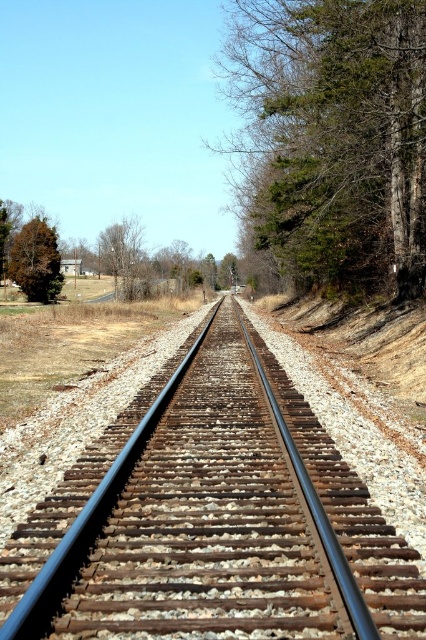
Question: Does rusty metal train track at center have a lesser width compared to green leafy tree at right?

Choices:
 (A) no
 (B) yes

Answer: (B)

Question: Which point is closer to the camera?

Choices:
 (A) green matte tree at left
 (B) green leafy tree at right
 (C) rusty metal train track at center

Answer: (C)

Question: Can you confirm if rusty metal train track at center is wider than green leafy tree at right?

Choices:
 (A) yes
 (B) no

Answer: (B)

Question: Which object is farther from the camera taking this photo?

Choices:
 (A) green matte tree at left
 (B) green leafy tree at right
 (C) rusty metal train track at center

Answer: (A)

Question: Based on their relative distances, which object is farther from the rusty metal train track at center?

Choices:
 (A) green leafy tree at right
 (B) green matte tree at left

Answer: (B)

Question: Observing the image, what is the correct spatial positioning of green leafy tree at right in reference to green matte tree at left?

Choices:
 (A) below
 (B) above

Answer: (B)